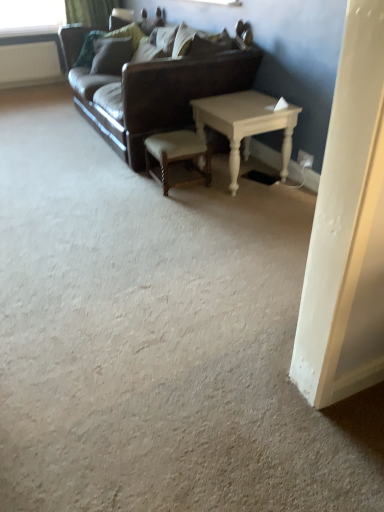
Identify the location of vacant area that is in front of wooden polished stool at center. Image resolution: width=384 pixels, height=512 pixels. (175, 203).